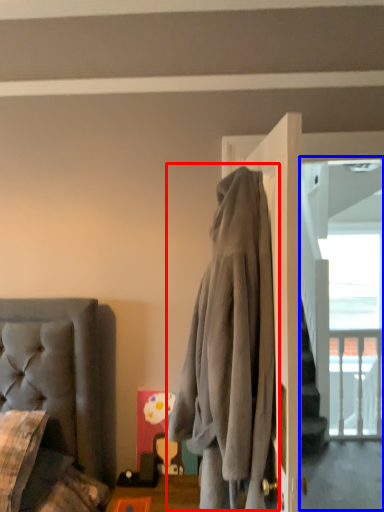
Question: Which object is closer to the camera taking this photo, clothing (highlighted by a red box) or screen door (highlighted by a blue box)?

Choices:
 (A) clothing
 (B) screen door

Answer: (A)